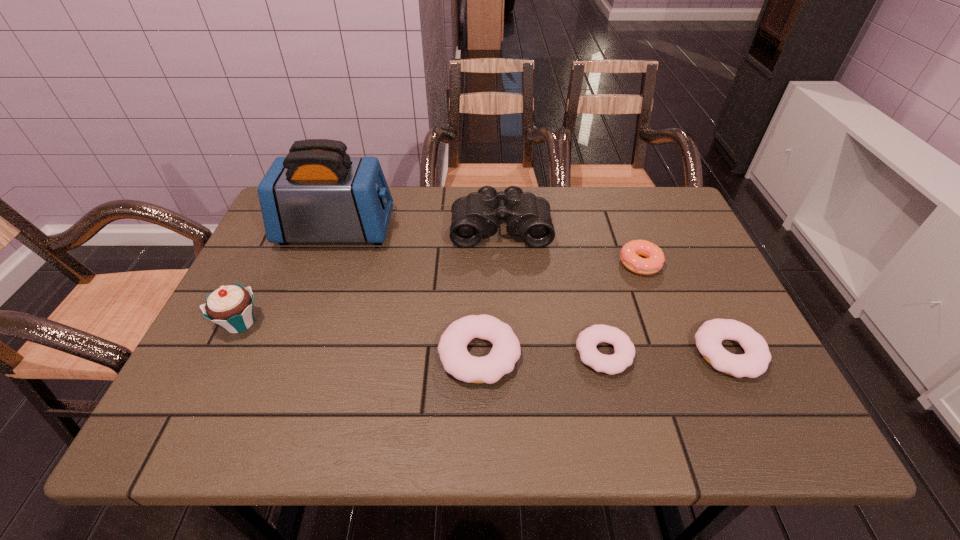
Please point out where to position a new doughnut on the left to maintain spacing. Please provide its 2D coordinates. Your answer should be formatted as a tuple, i.e. [(x, y)], where the tuple contains the x and y coordinates of a point satisfying the conditions above.

[(354, 355)]